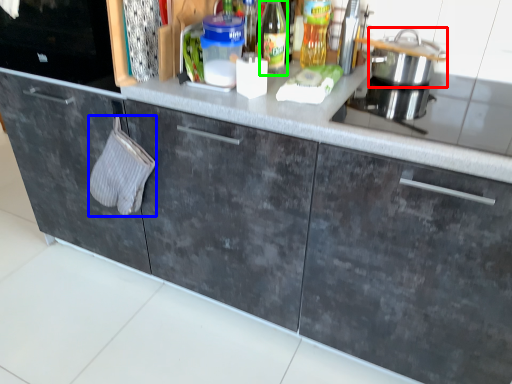
Question: Which object is the farthest from kitchen appliance (highlighted by a red box)? Choose among these: hand towel (highlighted by a blue box) or bottle (highlighted by a green box).

Choices:
 (A) hand towel
 (B) bottle

Answer: (A)